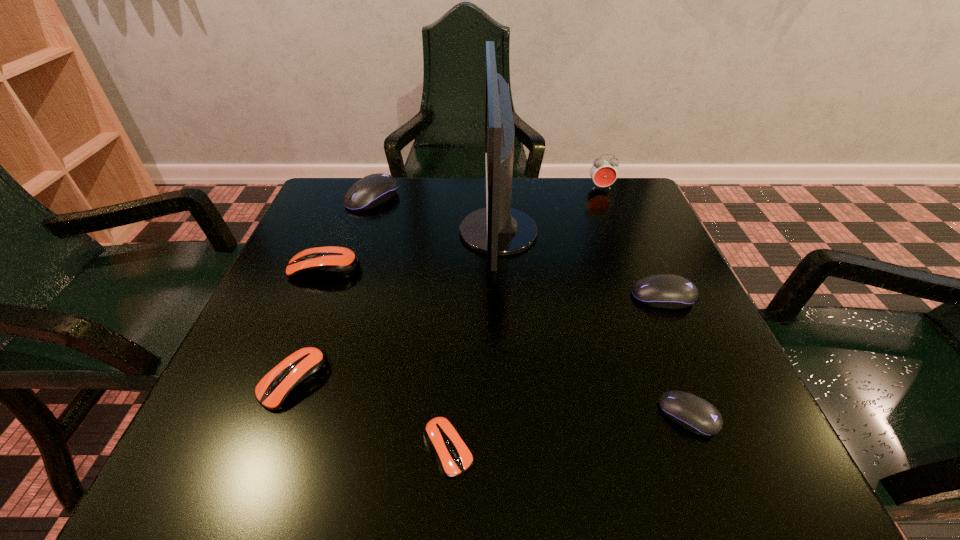
Where is `the tallest object`? Image resolution: width=960 pixels, height=540 pixels. the tallest object is located at coordinates (495, 230).

Locate an element on the screen. The height and width of the screenshot is (540, 960). alarm clock is located at coordinates (603, 173).

The height and width of the screenshot is (540, 960). What are the coordinates of `red alarm clock` in the screenshot? It's located at (603, 173).

Find the location of a particular element. The image size is (960, 540). the leftmost black computer mouse is located at coordinates click(372, 190).

Find the location of a particular element. the sixth shortest object is located at coordinates (372, 190).

At what (x,y) coordinates should I click in order to perform the action: click on the biggest orange computer mouse. Please return your answer as a coordinate pair (x, y). Looking at the image, I should click on (331, 263).

Locate an element on the screen. This screenshot has height=540, width=960. the second farthest computer mouse is located at coordinates (331, 263).

This screenshot has width=960, height=540. I want to click on the second biggest black computer mouse, so click(668, 291).

In order to click on the third farthest computer mouse in this screenshot , I will do `click(668, 291)`.

The height and width of the screenshot is (540, 960). In order to click on the second nearest orange computer mouse in this screenshot , I will do `click(302, 368)`.